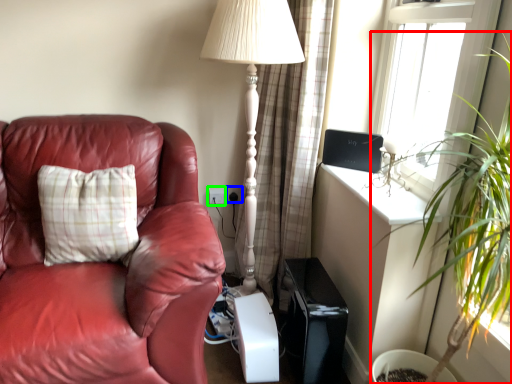
Question: Which object is positioned closest to houseplant (highlighted by a red box)? Select from electric outlet (highlighted by a blue box) and electric outlet (highlighted by a green box).

Choices:
 (A) electric outlet
 (B) electric outlet

Answer: (A)